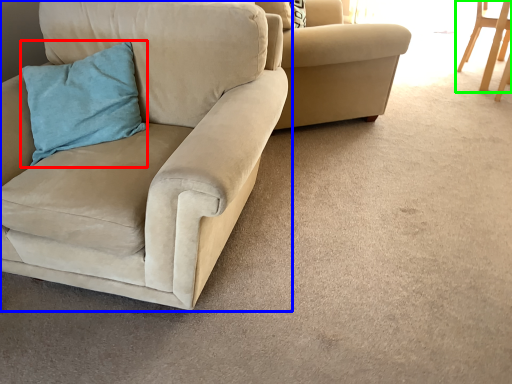
Question: Which object is positioned farthest from pillow (highlighted by a red box)? Select from chair (highlighted by a blue box) and chair (highlighted by a green box).

Choices:
 (A) chair
 (B) chair

Answer: (B)